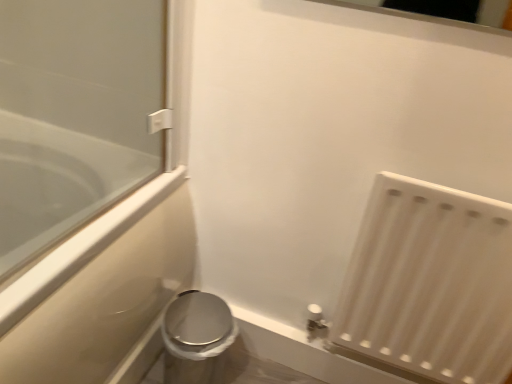
What do you see at coordinates (57, 183) in the screenshot? I see `clear glass bathtub at left` at bounding box center [57, 183].

At what (x,y) coordinates should I click in order to perform the action: click on clear glass bathtub at left. Please return your answer as a coordinate pair (x, y). Looking at the image, I should click on (57, 183).

In the scene shown: Who is shorter, satin silver toilet at lower left or clear glass bathtub at left?

Standing shorter between the two is satin silver toilet at lower left.

Is the position of satin silver toilet at lower left more distant than that of clear glass bathtub at left?

That is True.

Looking at this image, is clear glass bathtub at left inside satin silver toilet at lower left?

No, satin silver toilet at lower left does not contain clear glass bathtub at left.

From the image's perspective, is white matte radiator at lower right under clear glass bathtub at left?

Actually, white matte radiator at lower right appears above clear glass bathtub at left in the image.

Between white matte radiator at lower right and clear glass bathtub at left, which one has smaller width?

With smaller width is white matte radiator at lower right.

Could you tell me if white matte radiator at lower right is facing clear glass bathtub at left?

No, white matte radiator at lower right is not oriented towards clear glass bathtub at left.

Which is behind, white matte radiator at lower right or clear glass bathtub at left?

white matte radiator at lower right is further from the camera.

From their relative heights in the image, would you say white matte radiator at lower right is taller or shorter than satin silver toilet at lower left?

Considering their sizes, white matte radiator at lower right has more height than satin silver toilet at lower left.

Is satin silver toilet at lower left surrounded by white matte radiator at lower right?

Actually, satin silver toilet at lower left is outside white matte radiator at lower right.

Which is in front, point (425, 372) or point (179, 354)?

Positioned in front is point (179, 354).

Is white matte radiator at lower right at the left side of satin silver toilet at lower left?

No.

The image size is (512, 384). In the image, there is a satin silver toilet at lower left. Find the location of `bathtub above it (from the image's perspective)`. bathtub above it (from the image's perspective) is located at coordinates (57, 183).

Is clear glass bathtub at left turned away from satin silver toilet at lower left?

clear glass bathtub at left does not have its back to satin silver toilet at lower left.

Consider the image. Is clear glass bathtub at left bigger than satin silver toilet at lower left?

Correct, clear glass bathtub at left is larger in size than satin silver toilet at lower left.

Is the depth of clear glass bathtub at left less than that of white matte radiator at lower right?

Yes, clear glass bathtub at left is closer to the viewer.

Which of these two, clear glass bathtub at left or white matte radiator at lower right, stands taller?

With more height is clear glass bathtub at left.

This screenshot has height=384, width=512. Identify the location of radiator behind the clear glass bathtub at left. (429, 285).

Between clear glass bathtub at left and white matte radiator at lower right, which one has larger width?

clear glass bathtub at left is wider.

Is white matte radiator at lower right inside satin silver toilet at lower left?

No.

In the scene shown: Does satin silver toilet at lower left have a greater width compared to white matte radiator at lower right?

Yes.

From the image's perspective, which one is positioned lower, satin silver toilet at lower left or white matte radiator at lower right?

From the image's view, satin silver toilet at lower left is below.

Is satin silver toilet at lower left facing away from white matte radiator at lower right?

No.

Locate an element on the screen. toilet behind the clear glass bathtub at left is located at coordinates (197, 338).

Where is `bathtub lying below the white matte radiator at lower right (from the image's perspective)`? bathtub lying below the white matte radiator at lower right (from the image's perspective) is located at coordinates (57, 183).

From the image, which object appears to be farther from white matte radiator at lower right, satin silver toilet at lower left or clear glass bathtub at left?

clear glass bathtub at left is positioned further to the anchor white matte radiator at lower right.

When comparing their distances from satin silver toilet at lower left, does clear glass bathtub at left or white matte radiator at lower right seem further?

white matte radiator at lower right.

Based on their spatial positions, is clear glass bathtub at left or satin silver toilet at lower left closer to white matte radiator at lower right?

The object closer to white matte radiator at lower right is satin silver toilet at lower left.

Looking at the image, which one is located closer to clear glass bathtub at left, satin silver toilet at lower left or white matte radiator at lower right?

satin silver toilet at lower left lies closer to clear glass bathtub at left than the other object.

From the image, which object appears to be farther from satin silver toilet at lower left, white matte radiator at lower right or clear glass bathtub at left?

white matte radiator at lower right.

Estimate the real-world distances between objects in this image. Which object is closer to clear glass bathtub at left, white matte radiator at lower right or satin silver toilet at lower left?

satin silver toilet at lower left is positioned closer to the anchor clear glass bathtub at left.

The width and height of the screenshot is (512, 384). In order to click on toilet situated between clear glass bathtub at left and white matte radiator at lower right from left to right in this screenshot , I will do `click(197, 338)`.